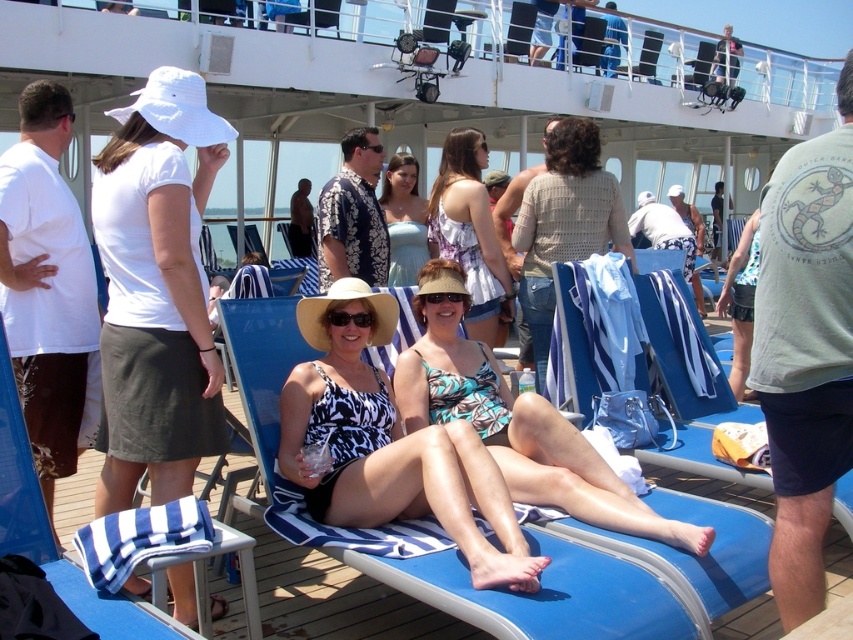
Who is shorter, white cotton hat at upper left or printed fabric tank top at center?

With less height is printed fabric tank top at center.

Which is more to the right, white cotton hat at upper left or printed fabric tank top at center?

From the viewer's perspective, printed fabric tank top at center appears more on the right side.

Locate an element on the screen. Image resolution: width=853 pixels, height=640 pixels. white cotton hat at upper left is located at coordinates (155, 292).

Is white cotton hat at upper left above light blue satin dress at center?

Incorrect, white cotton hat at upper left is not positioned above light blue satin dress at center.

Between white cotton hat at upper left and light blue satin dress at center, which one is positioned higher?

Positioned higher is light blue satin dress at center.

Find the location of a particular element. white cotton hat at upper left is located at coordinates (155, 292).

At what (x,y) coordinates should I click in order to perform the action: click on white cotton hat at upper left. Please return your answer as a coordinate pair (x, y). This screenshot has width=853, height=640. Looking at the image, I should click on (155, 292).

Is point (347, 444) positioned behind point (415, 371)?

That is False.

The width and height of the screenshot is (853, 640). Identify the location of printed fabric swimsuit at center. (389, 444).